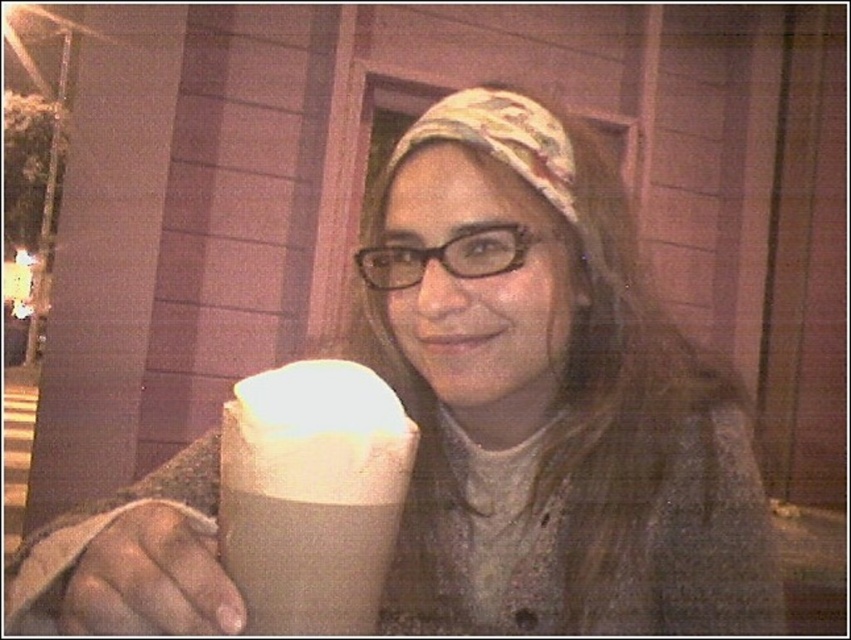
Question: Does white paper cup at center have a larger size compared to patterned fabric headscarf at center?

Choices:
 (A) yes
 (B) no

Answer: (B)

Question: Does smooth beige hand at lower left come behind patterned fabric headscarf at center?

Choices:
 (A) yes
 (B) no

Answer: (B)

Question: Which object is positioned closest to the white paper cup at center?

Choices:
 (A) patterned fabric headscarf at center
 (B) smooth beige hand at lower left

Answer: (B)

Question: Is white paper cup at center bigger than smooth beige hand at lower left?

Choices:
 (A) yes
 (B) no

Answer: (A)

Question: Which object appears farthest from the camera in this image?

Choices:
 (A) smooth beige hand at lower left
 (B) white paper cup at center
 (C) patterned fabric headscarf at center

Answer: (C)

Question: Which object appears closest to the camera in this image?

Choices:
 (A) patterned fabric headscarf at center
 (B) smooth beige hand at lower left
 (C) white paper cup at center

Answer: (B)